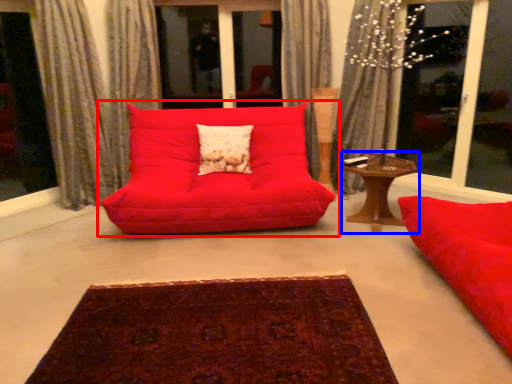
Question: Which object is closer to the camera taking this photo, studio couch (highlighted by a red box) or table (highlighted by a blue box)?

Choices:
 (A) studio couch
 (B) table

Answer: (A)